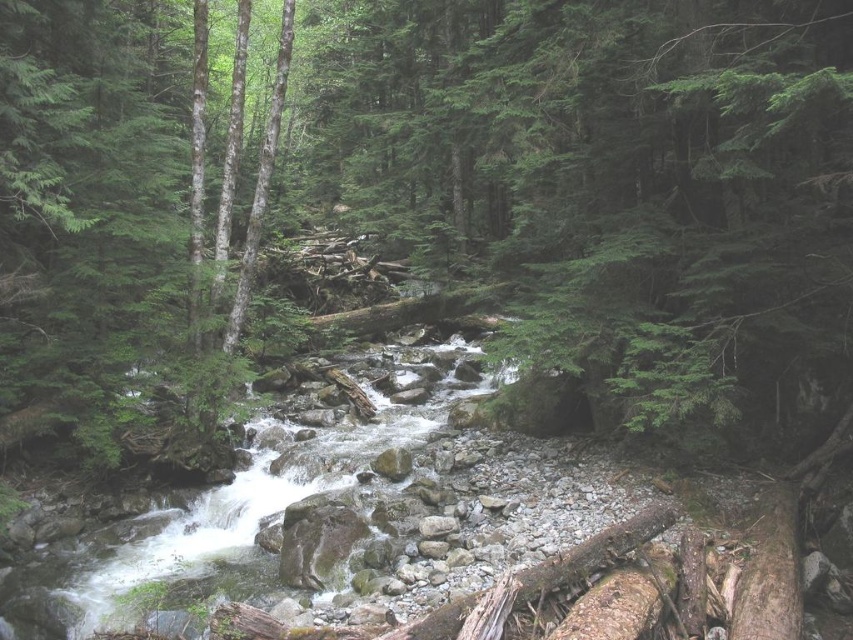
Question: Is green matte tree at center smaller than white frothy water at center?

Choices:
 (A) no
 (B) yes

Answer: (A)

Question: Can you confirm if green matte tree at center is wider than white frothy water at center?

Choices:
 (A) yes
 (B) no

Answer: (B)

Question: Which of the following is the farthest from the observer?

Choices:
 (A) (274, 458)
 (B) (88, 19)

Answer: (B)

Question: Which of the following is the farthest from the observer?

Choices:
 (A) tap(231, 556)
 (B) tap(128, 193)

Answer: (B)

Question: Can you confirm if green matte tree at center is smaller than white frothy water at center?

Choices:
 (A) yes
 (B) no

Answer: (B)

Question: Among these objects, which one is farthest from the camera?

Choices:
 (A) green matte tree at center
 (B) white frothy water at center

Answer: (A)